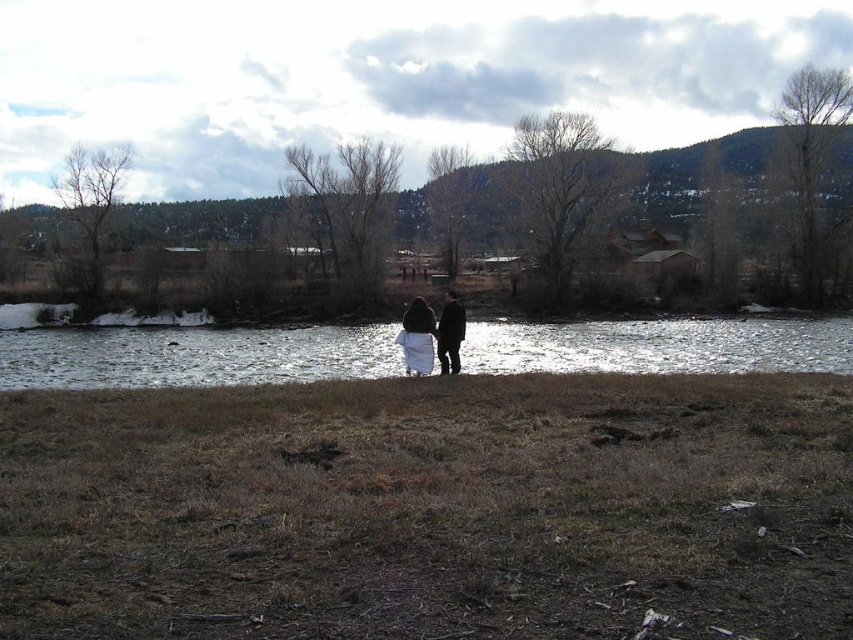
Question: Which of these objects is positioned farthest from the white wool coat at center?

Choices:
 (A) black matte coat at center
 (B) reflective silver water at center

Answer: (B)

Question: In this image, where is reflective silver water at center located relative to white wool coat at center?

Choices:
 (A) above
 (B) below

Answer: (B)

Question: Among these objects, which one is farthest from the camera?

Choices:
 (A) reflective silver water at center
 (B) white wool coat at center
 (C) black matte coat at center

Answer: (A)

Question: Is reflective silver water at center closer to the viewer compared to white wool coat at center?

Choices:
 (A) yes
 (B) no

Answer: (B)

Question: Which point is closer to the camera?

Choices:
 (A) click(x=428, y=333)
 (B) click(x=306, y=337)

Answer: (A)

Question: Can you confirm if white wool coat at center is smaller than black matte coat at center?

Choices:
 (A) yes
 (B) no

Answer: (B)